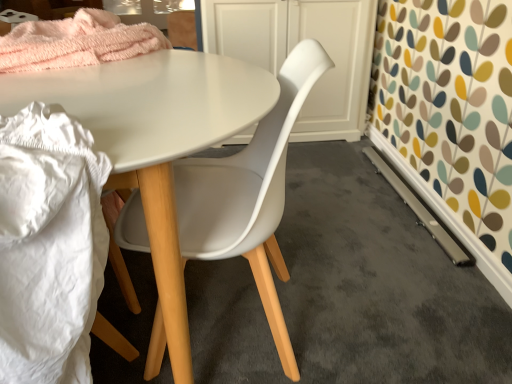
Identify the location of vacant area that is situated to the right of white plastic chair at center. (372, 308).